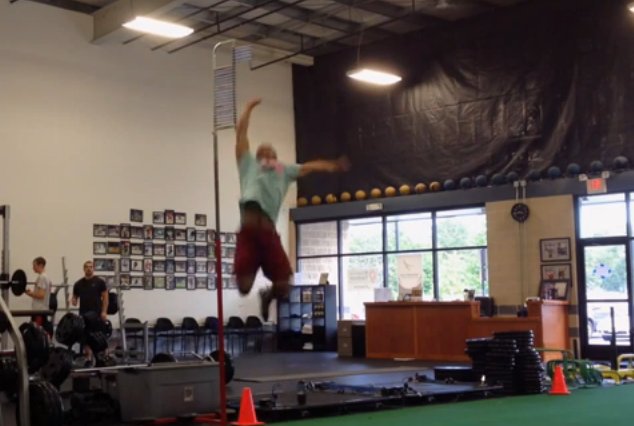
Find the location of a particular element. service desk is located at coordinates (460, 317).